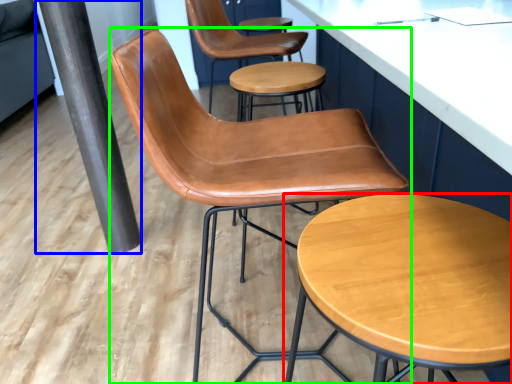
Question: Which is nearer to the stool (highlighted by a red box)? beam (highlighted by a blue box) or chair (highlighted by a green box).

Choices:
 (A) beam
 (B) chair

Answer: (B)